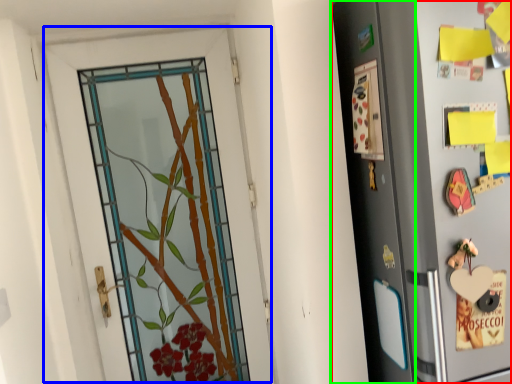
Question: Estimate the real-world distances between objects in this image. Which object is farther from refrigerator (highlighted by a red box), door (highlighted by a blue box) or screen door (highlighted by a green box)?

Choices:
 (A) door
 (B) screen door

Answer: (A)